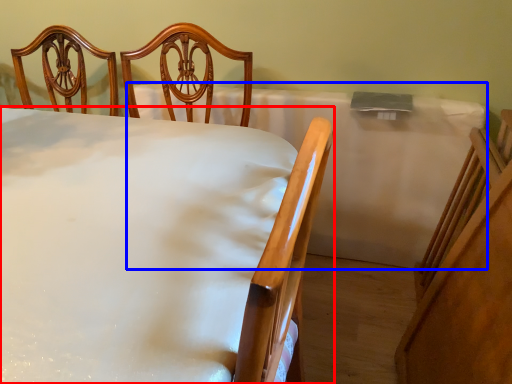
Question: Which object appears closest to the camera in this image, furniture (highlighted by a red box) or tablecloth (highlighted by a blue box)?

Choices:
 (A) furniture
 (B) tablecloth

Answer: (A)